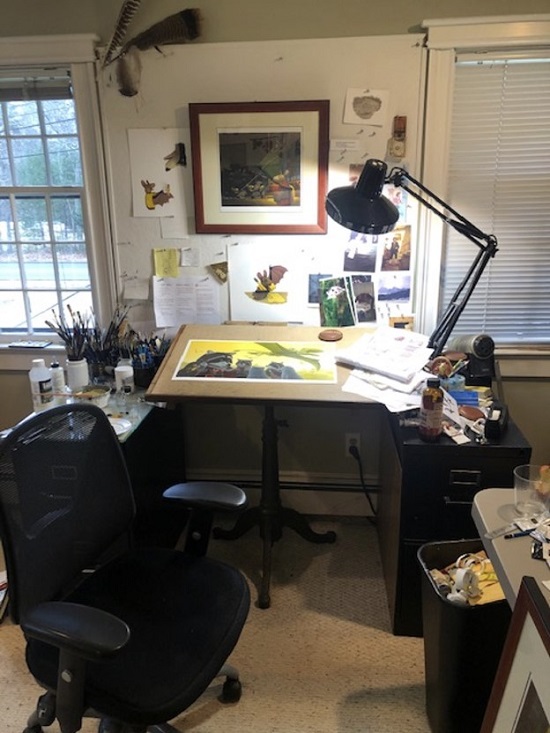
This screenshot has width=550, height=733. Identify the location of tan wall, background. (310, 15).